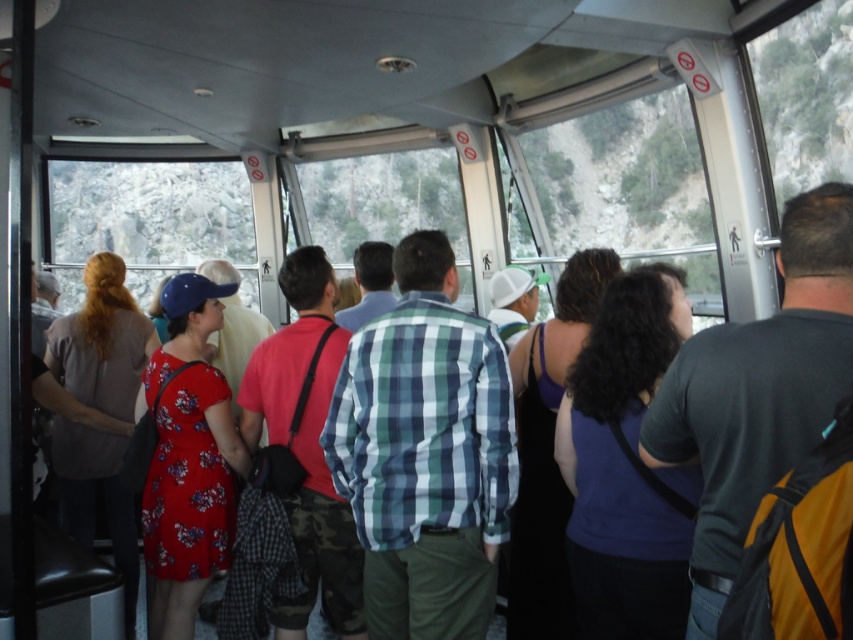
Who is more forward, (363, 426) or (318, 252)?

Point (363, 426)

Is point (395, 435) positioned before point (257, 349)?

Yes, it is.

Identify the location of green plaid shirt at center. This screenshot has width=853, height=640. (425, 452).

Is green plaid shirt at center thinner than floral dress at left?

Correct, green plaid shirt at center's width is less than floral dress at left's.

Who is more forward, (473, 458) or (82, 317)?

Positioned in front is point (473, 458).

Is point (440, 314) positioned after point (128, 625)?

No, (440, 314) is in front of (128, 625).

The width and height of the screenshot is (853, 640). In order to click on green plaid shirt at center in this screenshot , I will do `click(425, 452)`.

Is dark gray backpack at center bigger than camo pants at center?

Indeed, dark gray backpack at center has a larger size compared to camo pants at center.

In the scene shown: Measure the distance between dark gray backpack at center and camera.

A distance of 5.83 feet exists between dark gray backpack at center and camera.

Locate an element on the screen. dark gray backpack at center is located at coordinates (758, 392).